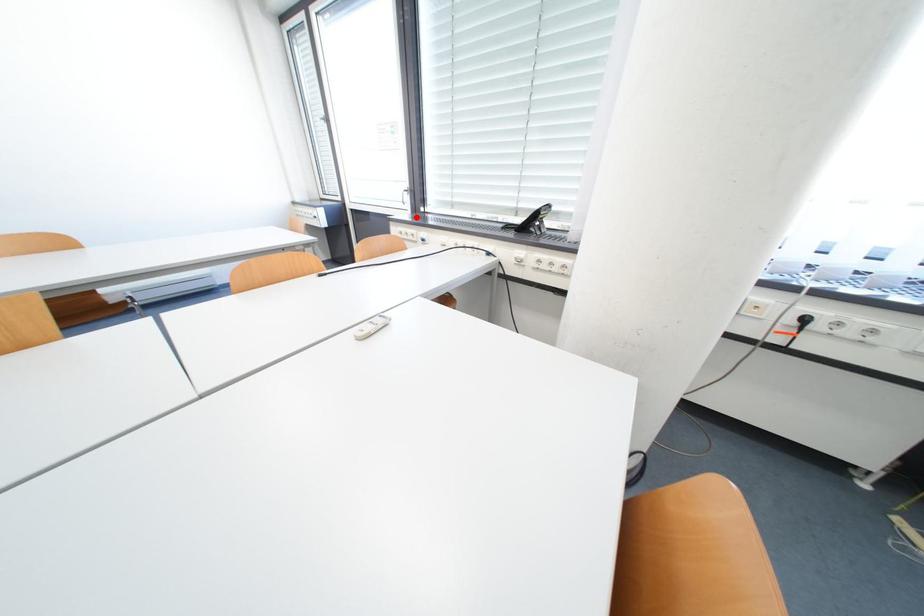
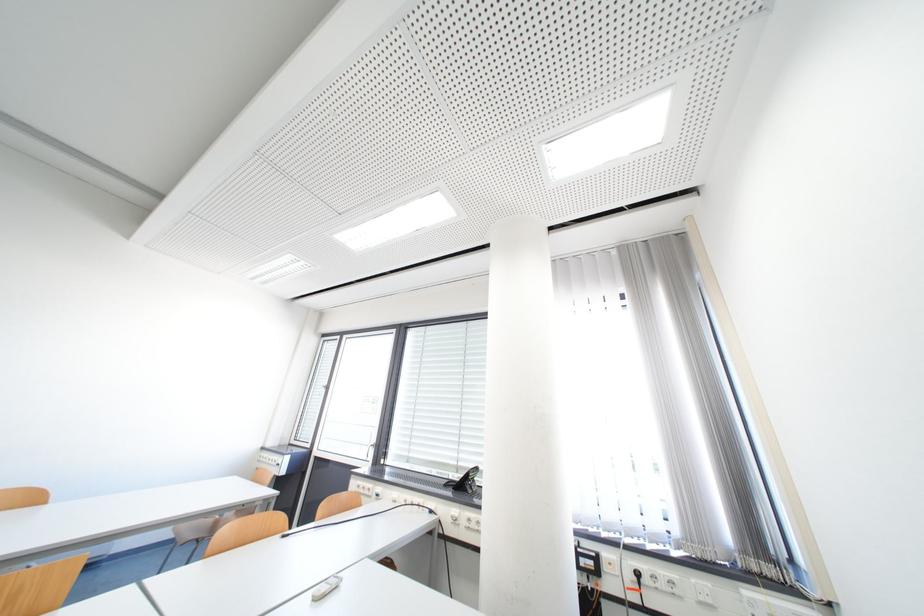
Question: I am providing you with two images of the same scene from different viewpoints. A red point is shown in image1. For the corresponding object point in image2, is it positioned nearer or farther from the camera?

Choices:
 (A) Nearer
 (B) Farther

Answer: (B)